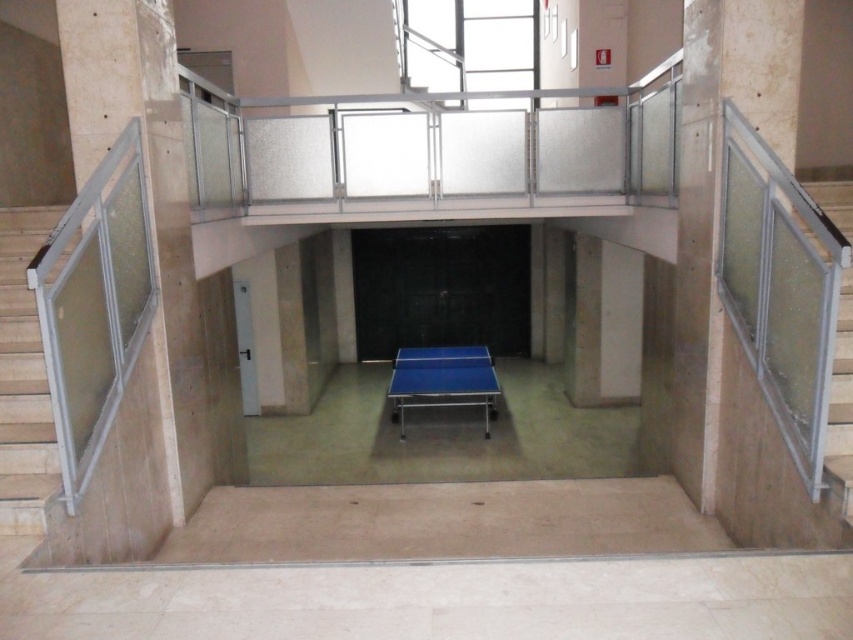
Is metallic gray handrail at left to the left of clear glass railing at right from the viewer's perspective?

Yes, metallic gray handrail at left is to the left of clear glass railing at right.

Is point (47, 412) behind point (840, 419)?

Yes.

Where is `metallic gray handrail at left`? This screenshot has width=853, height=640. metallic gray handrail at left is located at coordinates (22, 380).

Who is positioned more to the right, metallic gray handrail at left or blue rubber table tennis table at center?

blue rubber table tennis table at center

Can you confirm if metallic gray handrail at left is positioned to the right of blue rubber table tennis table at center?

No, metallic gray handrail at left is not to the right of blue rubber table tennis table at center.

What do you see at coordinates (22, 380) in the screenshot? The width and height of the screenshot is (853, 640). I see `metallic gray handrail at left` at bounding box center [22, 380].

Where is `metallic gray handrail at left`? This screenshot has width=853, height=640. metallic gray handrail at left is located at coordinates (22, 380).

Does metallic gray handrail at left appear on the right side of blue glossy table tennis table at center?

No, metallic gray handrail at left is not to the right of blue glossy table tennis table at center.

Is metallic gray handrail at left smaller than blue glossy table tennis table at center?

No, metallic gray handrail at left is not smaller than blue glossy table tennis table at center.

Between point (35, 516) and point (428, 400), which one is positioned behind?

Point (428, 400)

Image resolution: width=853 pixels, height=640 pixels. I want to click on metallic gray handrail at left, so click(x=22, y=380).